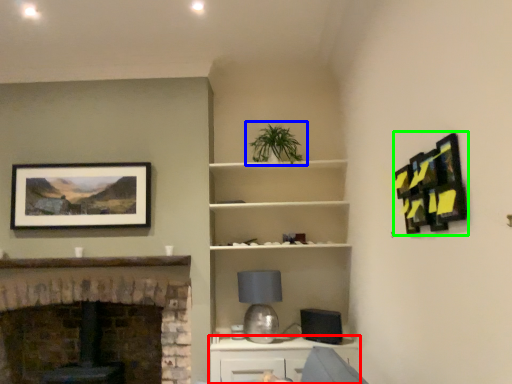
Question: Based on their relative distances, which object is farther from cabinetry (highlighted by a red box)? Choose from houseplant (highlighted by a blue box) and picture frame (highlighted by a green box).

Choices:
 (A) houseplant
 (B) picture frame

Answer: (B)